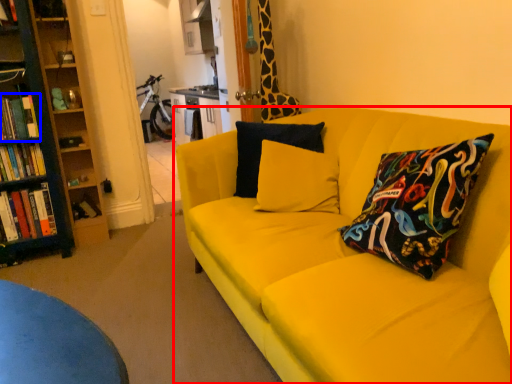
Question: Which point is further to the camera, studio couch (highlighted by a red box) or book (highlighted by a blue box)?

Choices:
 (A) studio couch
 (B) book

Answer: (B)